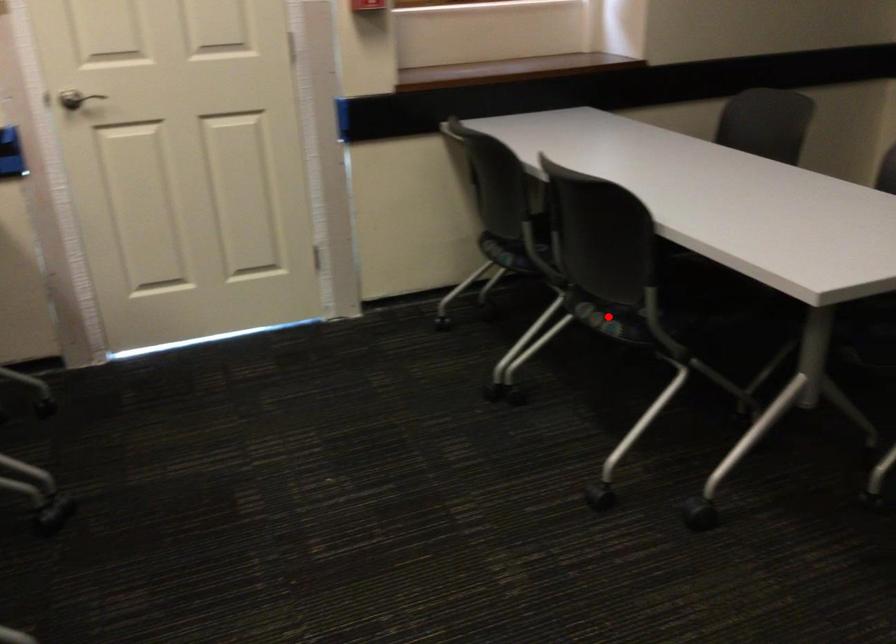
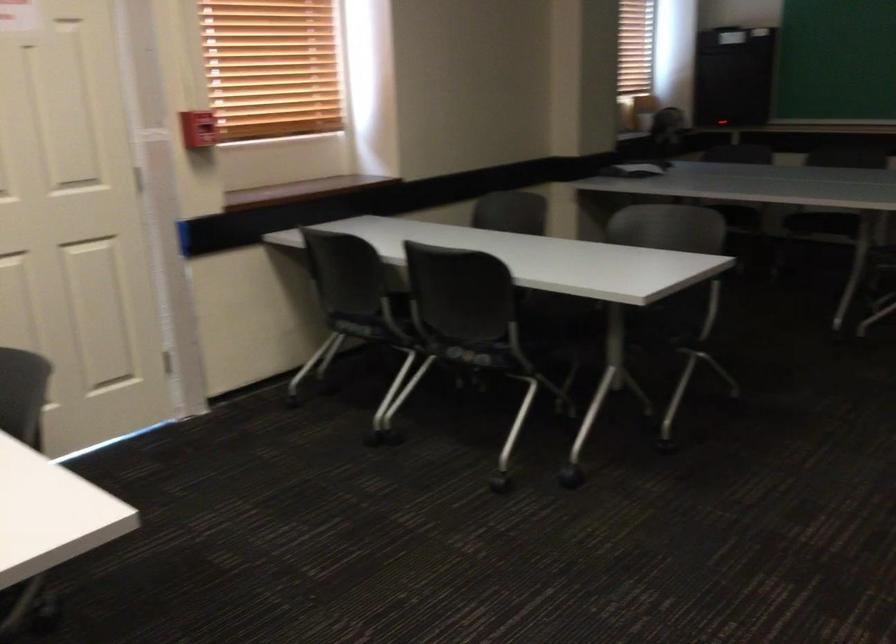
Question: A red point is marked in image1. In image2, is the corresponding 3D point closer to the camera or farther? Reply with the corresponding letter.

Choices:
 (A) The corresponding 3D point is closer.
 (B) The corresponding 3D point is farther.

Answer: (B)